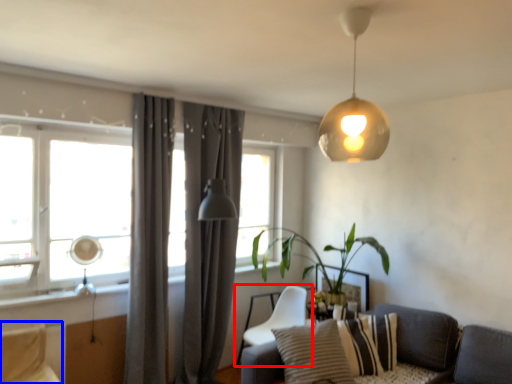
Question: Which object is closer to the camera taking this photo, chair (highlighted by a red box) or swivel chair (highlighted by a blue box)?

Choices:
 (A) chair
 (B) swivel chair

Answer: (B)